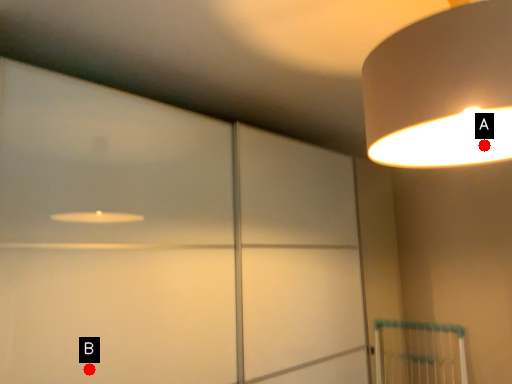
Question: Two points are circled on the image, labeled by A and B beside each circle. Which of the following is the farthest from the observer?

Choices:
 (A) A is further
 (B) B is further

Answer: (A)